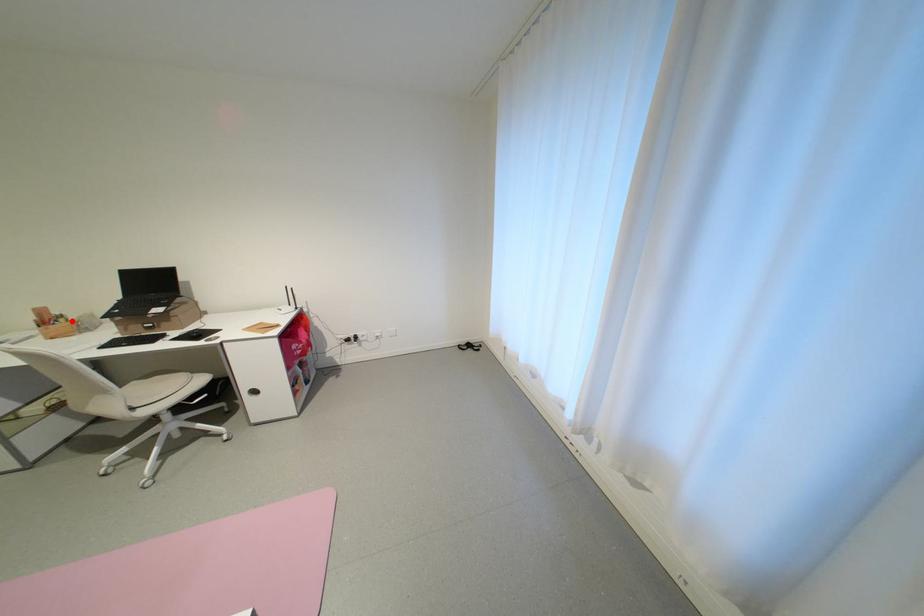
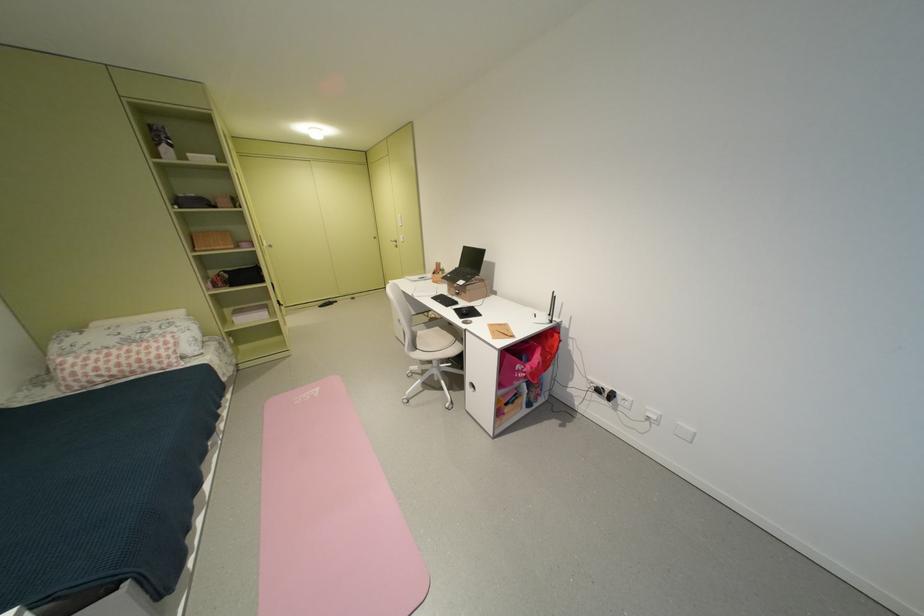
Find the pixel in the second image that matches the highlighted location in the first image.

(450, 274)